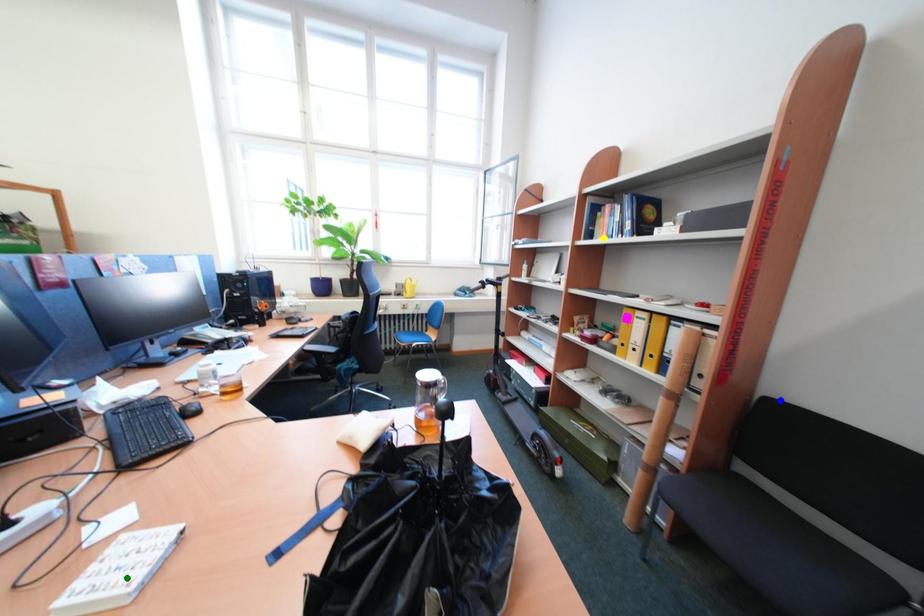
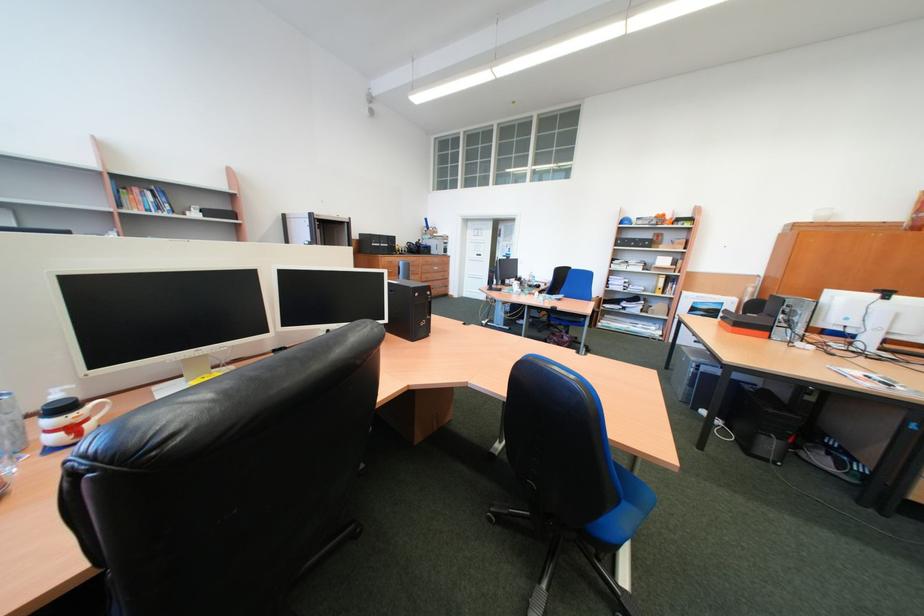
I am providing you with two images of the same scene from different viewpoints. Three points are marked in image1. Which point corresponds to a part or object that is occluded in image2?In image1, three points are marked. Which of them correspond to a part or object that is occluded in image2?Among the three points shown in image1, which one corresponds to a part or object that is no longer visible due to occlusion in image2?

Invisible in image2: green point, blue point.